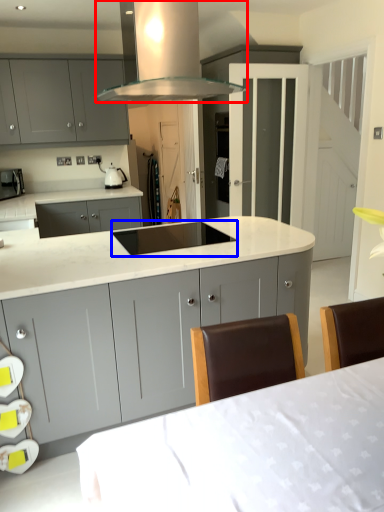
Question: Which of the following is the closest to the observer, home appliance (highlighted by a red box) or sink (highlighted by a blue box)?

Choices:
 (A) home appliance
 (B) sink

Answer: (A)